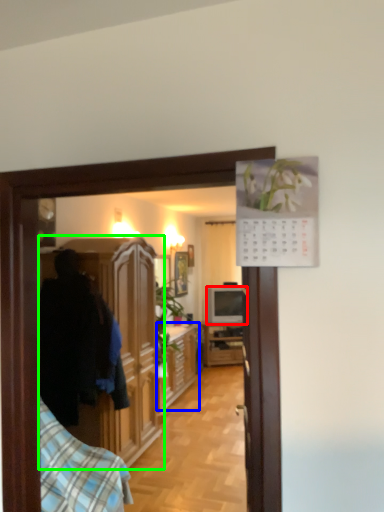
Question: Which object is positioned farthest from television (highlighted by a red box)? Select from cabinetry (highlighted by a blue box) and cabinetry (highlighted by a green box).

Choices:
 (A) cabinetry
 (B) cabinetry

Answer: (B)